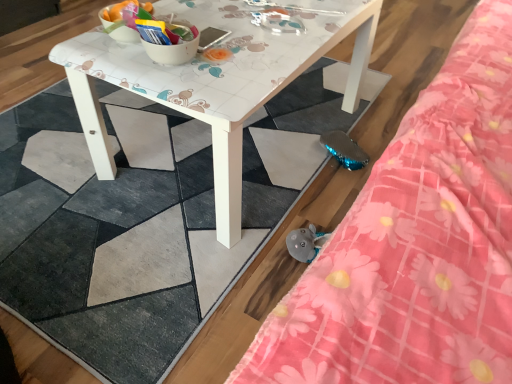
Question: From their relative heights in the image, would you say pink floral fabric at upper right is taller or shorter than white glossy table at center?

Choices:
 (A) short
 (B) tall

Answer: (B)

Question: From the image's perspective, relative to white glossy table at center, is pink floral fabric at upper right above or below?

Choices:
 (A) below
 (B) above

Answer: (A)

Question: Considering their positions, is pink floral fabric at upper right located in front of or behind white glossy table at center?

Choices:
 (A) front
 (B) behind

Answer: (A)

Question: Looking at the image, does white glossy table at center seem bigger or smaller compared to pink floral fabric at upper right?

Choices:
 (A) small
 (B) big

Answer: (B)

Question: Would you say white glossy table at center is inside or outside pink floral fabric at upper right?

Choices:
 (A) inside
 (B) outside

Answer: (B)

Question: From a real-world perspective, is white glossy table at center positioned above or below pink floral fabric at upper right?

Choices:
 (A) above
 (B) below

Answer: (B)

Question: From the image's perspective, is white glossy table at center above or below pink floral fabric at upper right?

Choices:
 (A) above
 (B) below

Answer: (A)